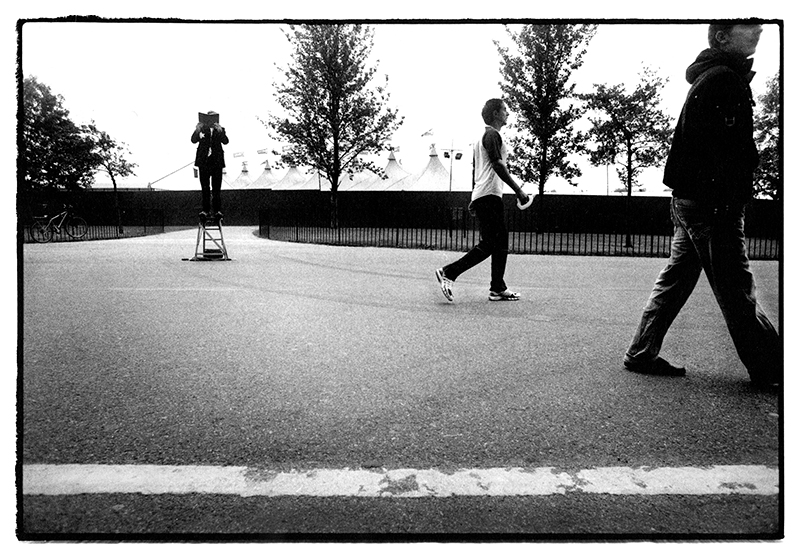
In order to click on collapsiable  ladder in this screenshot , I will do `click(210, 227)`, `click(214, 241)`.